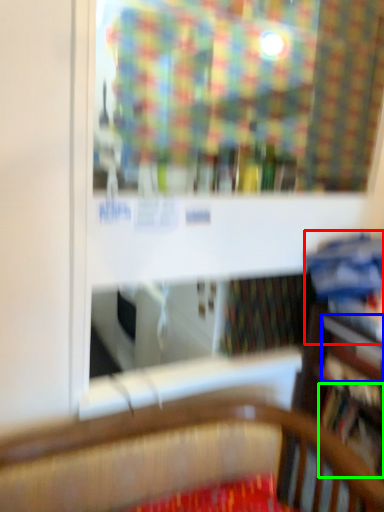
Question: Which object is positioned closest to book (highlighted by a red box)? Select from book (highlighted by a blue box) and book (highlighted by a green box).

Choices:
 (A) book
 (B) book

Answer: (A)